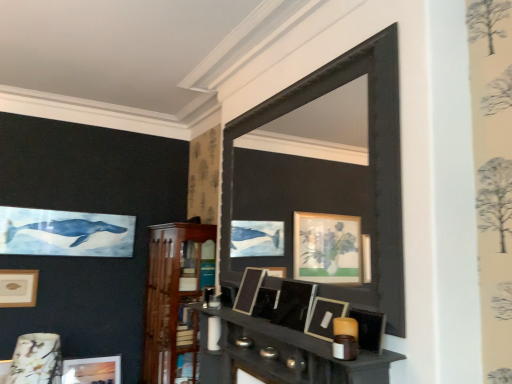
Question: Which direction should I rotate to face matte black shelf at center, the first shelf in the front-to-back sequence, — up or down?

Choices:
 (A) down
 (B) up

Answer: (A)

Question: Should I look upward or downward to see matte black picture frame at center, which is counted as the 5th picture frame, starting from the bottom?

Choices:
 (A) up
 (B) down

Answer: (B)

Question: From a real-world perspective, is wooden shelf at center, the second shelf in the right-to-left sequence, over porcelain floral-patterned lampshade at lower left?

Choices:
 (A) yes
 (B) no

Answer: (A)

Question: From the image's perspective, is wooden shelf at center, arranged as the 1th shelf when viewed from the left, beneath porcelain floral-patterned lampshade at lower left?

Choices:
 (A) yes
 (B) no

Answer: (B)

Question: From a real-world perspective, is wooden shelf at center, arranged as the first shelf when viewed from the back, positioned under porcelain floral-patterned lampshade at lower left based on gravity?

Choices:
 (A) no
 (B) yes

Answer: (A)

Question: Does wooden shelf at center, arranged as the 1th shelf when viewed from the left, have a lesser height compared to porcelain floral-patterned lampshade at lower left?

Choices:
 (A) yes
 (B) no

Answer: (B)

Question: Can you confirm if wooden shelf at center, arranged as the 1th shelf when viewed from the left, is smaller than porcelain floral-patterned lampshade at lower left?

Choices:
 (A) no
 (B) yes

Answer: (A)

Question: Does wooden shelf at center, arranged as the 1th shelf when viewed from the left, have a greater width compared to porcelain floral-patterned lampshade at lower left?

Choices:
 (A) no
 (B) yes

Answer: (B)

Question: Considering the relative positions of matte gold picture frame at upper left, arranged as the 5th picture frame when viewed from the right, and wooden shelf at center, the second shelf in the right-to-left sequence, in the image provided, is matte gold picture frame at upper left, arranged as the 5th picture frame when viewed from the right, behind wooden shelf at center, the second shelf in the right-to-left sequence,?

Choices:
 (A) no
 (B) yes

Answer: (B)

Question: Is matte gold picture frame at upper left, placed as the second picture frame when sorted from back to front, shorter than wooden shelf at center, arranged as the first shelf when viewed from the back?

Choices:
 (A) yes
 (B) no

Answer: (A)

Question: Does matte gold picture frame at upper left, placed as the fourth picture frame when sorted from front to back, turn towards wooden shelf at center, arranged as the 1th shelf when viewed from the left?

Choices:
 (A) yes
 (B) no

Answer: (B)

Question: Can you confirm if matte gold picture frame at upper left, which ranks as the second picture frame in bottom-to-top order, is bigger than wooden shelf at center, arranged as the 1th shelf when viewed from the left?

Choices:
 (A) yes
 (B) no

Answer: (B)

Question: From the image's perspective, is matte gold picture frame at upper left, placed as the fourth picture frame when sorted from front to back, on wooden shelf at center, arranged as the 1th shelf when viewed from the left?

Choices:
 (A) no
 (B) yes

Answer: (B)

Question: Is matte gold picture frame at upper left, placed as the second picture frame when sorted from back to front, at the right side of wooden shelf at center, the 2th shelf from the front?

Choices:
 (A) yes
 (B) no

Answer: (B)

Question: Can you confirm if matte black picture frame at center, the fifth picture frame when ordered from back to front, is wider than matte wooden picture frame at lower left, which is the 4th picture frame in right-to-left order?

Choices:
 (A) no
 (B) yes

Answer: (A)